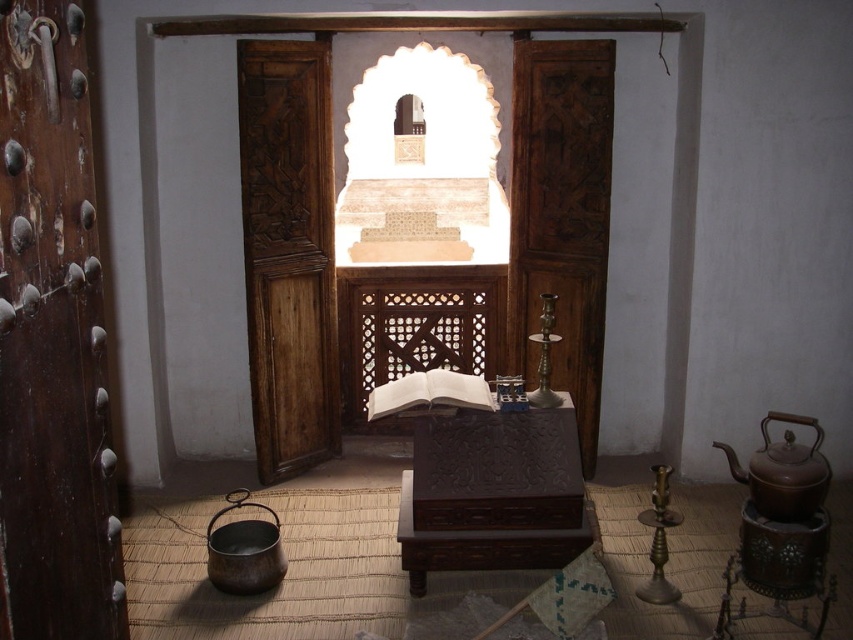
Question: Does dark wood carved door at center appear under matte brown teapot at lower right?

Choices:
 (A) yes
 (B) no

Answer: (B)

Question: Estimate the real-world distances between objects in this image. Which object is farther from the dark brown wood door at left?

Choices:
 (A) matte brown teapot at lower right
 (B) wooden carved door at center

Answer: (B)

Question: Can you confirm if dark brown wood door at left is positioned above dark wood carved door at center?

Choices:
 (A) yes
 (B) no

Answer: (B)

Question: Which object appears closest to the camera in this image?

Choices:
 (A) dark brown wood door at left
 (B) matte brown teapot at lower right
 (C) dark wood carved door at center

Answer: (A)

Question: Does wooden carved door at center appear under dark wood carved door at center?

Choices:
 (A) no
 (B) yes

Answer: (B)

Question: Which point appears farthest from the camera in this image?

Choices:
 (A) (22, 0)
 (B) (325, 436)
 (C) (799, 486)
 (D) (556, 292)

Answer: (B)